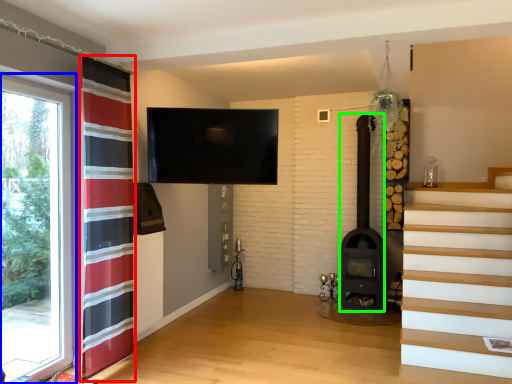
Question: Estimate the real-world distances between objects in this image. Which object is farther from curtain (highlighted by a red box), window (highlighted by a blue box) or fireplace (highlighted by a green box)?

Choices:
 (A) window
 (B) fireplace

Answer: (B)